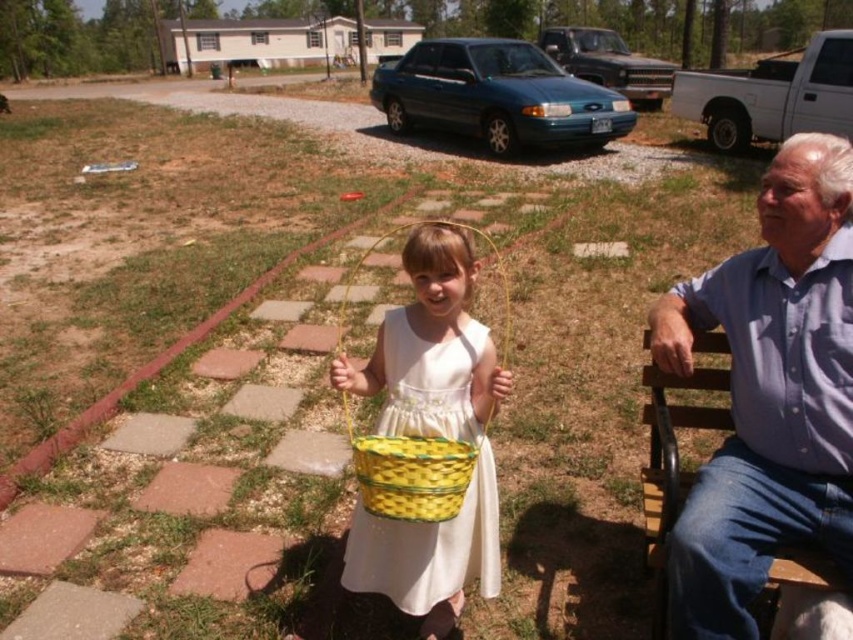
You are a photographer standing in front of the scene. You want to take a photo that includes both the blue cotton shirt at right and the yellow woven basket at center. Which object should you adjust your camera focus to first to ensure both are in focus?

The blue cotton shirt at right is closer to the viewer than the yellow woven basket at center, so you should focus on the blue cotton shirt at right first to ensure both are in focus.